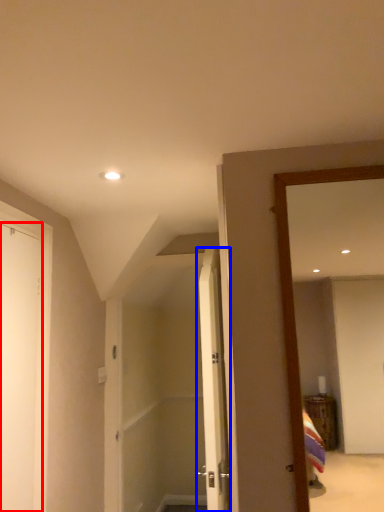
Question: Which object is further to the camera taking this photo, door (highlighted by a red box) or door (highlighted by a blue box)?

Choices:
 (A) door
 (B) door

Answer: (B)